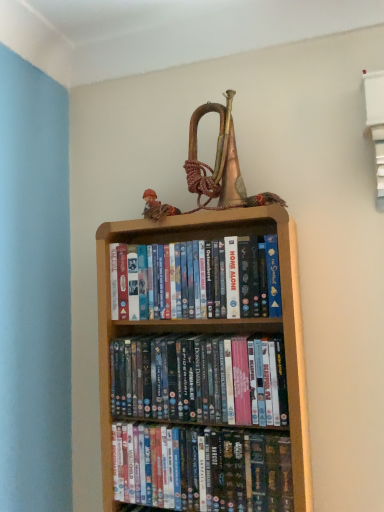
Question: Should I look upward or downward to see shiny plastic dvds at center, arranged as the first book when ordered from the bottom?

Choices:
 (A) up
 (B) down

Answer: (B)

Question: Is wooden bookcase at center thinner than matte brown doll at upper center?

Choices:
 (A) yes
 (B) no

Answer: (B)

Question: Considering the relative positions of wooden bookcase at center and matte brown doll at upper center in the image provided, is wooden bookcase at center to the right of matte brown doll at upper center from the viewer's perspective?

Choices:
 (A) yes
 (B) no

Answer: (A)

Question: Can you confirm if wooden bookcase at center is bigger than matte brown doll at upper center?

Choices:
 (A) yes
 (B) no

Answer: (A)

Question: From a real-world perspective, is wooden bookcase at center on top of matte brown doll at upper center?

Choices:
 (A) no
 (B) yes

Answer: (A)

Question: Is wooden bookcase at center wider than matte brown doll at upper center?

Choices:
 (A) no
 (B) yes

Answer: (B)

Question: Does wooden bookcase at center appear on the left side of matte brown doll at upper center?

Choices:
 (A) yes
 (B) no

Answer: (B)

Question: From the image's perspective, would you say matte plastic dvds at center, the first book viewed from the top, is positioned over shiny plastic dvds at center, arranged as the first book when ordered from the bottom?

Choices:
 (A) no
 (B) yes

Answer: (B)

Question: Can you see matte plastic dvds at center, the first book viewed from the top, touching shiny plastic dvds at center, which is the third book from top to bottom?

Choices:
 (A) no
 (B) yes

Answer: (A)

Question: Is matte plastic dvds at center, the first book viewed from the top, positioned beyond the bounds of shiny plastic dvds at center, which is the third book from top to bottom?

Choices:
 (A) yes
 (B) no

Answer: (A)

Question: From the image's perspective, does matte plastic dvds at center, the first book viewed from the top, appear lower than shiny plastic dvds at center, which is the third book from top to bottom?

Choices:
 (A) yes
 (B) no

Answer: (B)

Question: Would you say shiny plastic dvds at center, which is the third book from top to bottom, is part of matte plastic dvds at center, the first book viewed from the top,'s contents?

Choices:
 (A) yes
 (B) no

Answer: (B)

Question: Is matte plastic dvds at center, acting as the 3th book starting from the bottom, bigger than shiny plastic dvds at center, which is the third book from top to bottom?

Choices:
 (A) yes
 (B) no

Answer: (A)

Question: Is matte plastic dvds at center, acting as the 3th book starting from the bottom, surrounded by wooden bookcase at center?

Choices:
 (A) no
 (B) yes

Answer: (B)